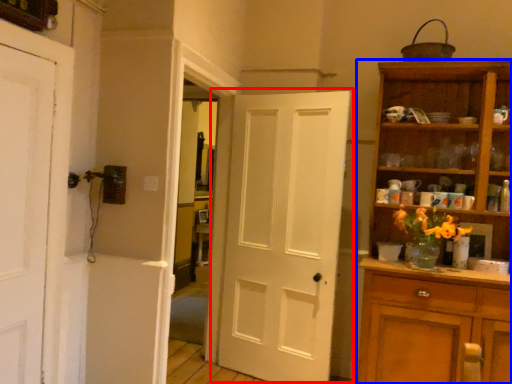
Question: Which object appears farthest to the camera in this image, door (highlighted by a red box) or cupboard (highlighted by a blue box)?

Choices:
 (A) door
 (B) cupboard

Answer: (A)